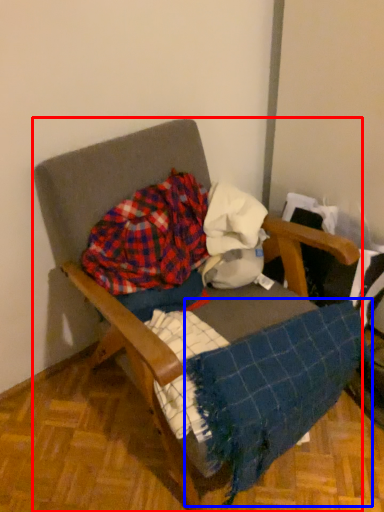
Question: Which object appears closest to the camera in this image, furniture (highlighted by a red box) or blanket (highlighted by a blue box)?

Choices:
 (A) furniture
 (B) blanket

Answer: (A)